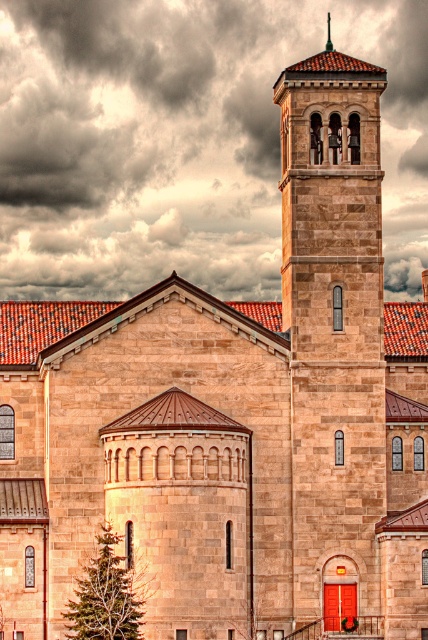
Is dark gray cloud at upper center wider than gold textured cross at upper center?

Yes.

How far apart are dark gray cloud at upper center and gold textured cross at upper center?

A distance of 19.48 meters exists between dark gray cloud at upper center and gold textured cross at upper center.

This screenshot has width=428, height=640. I want to click on dark gray cloud at upper center, so click(183, 140).

The image size is (428, 640). Find the location of `stone bell tower at center`. stone bell tower at center is located at coordinates (332, 205).

Who is lower down, stone bell tower at center or gold textured cross at upper center?

Positioned lower is stone bell tower at center.

Find the location of a particular element. This screenshot has width=428, height=640. stone bell tower at center is located at coordinates (332, 205).

Where is `stone bell tower at center`? The height and width of the screenshot is (640, 428). stone bell tower at center is located at coordinates (332, 205).

Does dark gray cloud at upper center appear under stone bell tower at center?

Actually, dark gray cloud at upper center is above stone bell tower at center.

In the scene shown: Which is above, dark gray cloud at upper center or stone bell tower at center?

dark gray cloud at upper center

Find the location of a particular element. This screenshot has height=640, width=428. dark gray cloud at upper center is located at coordinates (183, 140).